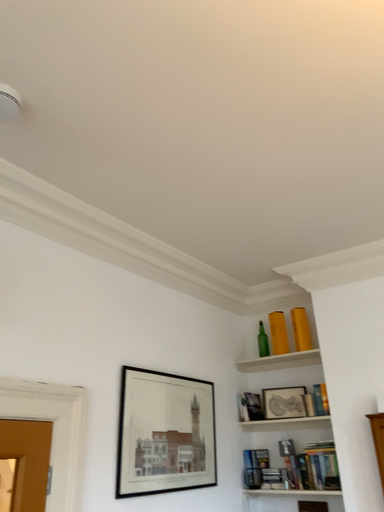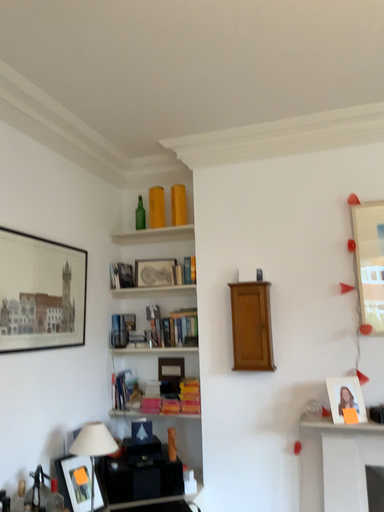
Question: How did the camera likely rotate when shooting the video?

Choices:
 (A) rotated right
 (B) rotated left

Answer: (A)